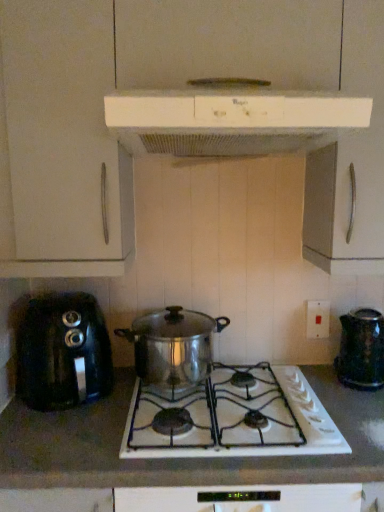
Question: Is shiny metallic kettle at right, the 1th kitchen appliance in the bottom-to-top sequence, to the right of white plastic electric outlet at right from the viewer's perspective?

Choices:
 (A) no
 (B) yes

Answer: (B)

Question: From a real-world perspective, is shiny metallic kettle at right, the 1th kitchen appliance in the bottom-to-top sequence, physically above white plastic electric outlet at right?

Choices:
 (A) yes
 (B) no

Answer: (B)

Question: Considering the relative sizes of shiny metallic kettle at right, acting as the 1th kitchen appliance starting from the right, and white plastic electric outlet at right in the image provided, is shiny metallic kettle at right, acting as the 1th kitchen appliance starting from the right, wider than white plastic electric outlet at right?

Choices:
 (A) yes
 (B) no

Answer: (A)

Question: Considering the relative positions of shiny metallic kettle at right, placed as the 4th kitchen appliance when sorted from top to bottom, and white plastic electric outlet at right in the image provided, is shiny metallic kettle at right, placed as the 4th kitchen appliance when sorted from top to bottom, behind white plastic electric outlet at right?

Choices:
 (A) yes
 (B) no

Answer: (B)

Question: Is shiny metallic kettle at right, marked as the fourth kitchen appliance in a left-to-right arrangement, at the left side of white plastic electric outlet at right?

Choices:
 (A) yes
 (B) no

Answer: (B)

Question: From the image's perspective, relative to white plastic range hood at upper center, which appears as the third kitchen appliance when viewed from the left, is black plastic toaster at left, which appears as the 3th kitchen appliance when viewed from the top, above or below?

Choices:
 (A) below
 (B) above

Answer: (A)

Question: Is black plastic toaster at left, which appears as the 3th kitchen appliance when viewed from the top, inside or outside of white plastic range hood at upper center, marked as the second kitchen appliance in a right-to-left arrangement?

Choices:
 (A) inside
 (B) outside

Answer: (B)

Question: Is black plastic toaster at left, positioned as the first kitchen appliance in left-to-right order, bigger or smaller than white plastic range hood at upper center, the 4th kitchen appliance ordered from the bottom?

Choices:
 (A) big
 (B) small

Answer: (B)

Question: Considering the relative positions of black plastic toaster at left, positioned as the first kitchen appliance in left-to-right order, and white plastic range hood at upper center, the 4th kitchen appliance ordered from the bottom, in the image provided, is black plastic toaster at left, positioned as the first kitchen appliance in left-to-right order, to the left or to the right of white plastic range hood at upper center, the 4th kitchen appliance ordered from the bottom,?

Choices:
 (A) right
 (B) left

Answer: (B)

Question: From a real-world perspective, relative to black plastic toaster at left, the second kitchen appliance positioned from the bottom, is white plastic range hood at upper center, arranged as the first kitchen appliance when viewed from the top, vertically above or below?

Choices:
 (A) above
 (B) below

Answer: (A)

Question: Does point (284, 103) appear closer or farther from the camera than point (97, 398)?

Choices:
 (A) farther
 (B) closer

Answer: (B)

Question: Is white plastic range hood at upper center, marked as the second kitchen appliance in a right-to-left arrangement, to the left or to the right of black plastic toaster at left, positioned as the first kitchen appliance in left-to-right order, in the image?

Choices:
 (A) left
 (B) right

Answer: (B)

Question: Looking at the image, does white plastic range hood at upper center, arranged as the first kitchen appliance when viewed from the top, seem bigger or smaller compared to black plastic toaster at left, positioned as the 4th kitchen appliance in right-to-left order?

Choices:
 (A) small
 (B) big

Answer: (B)

Question: Is black plastic toaster at left, positioned as the 4th kitchen appliance in right-to-left order, in front of or behind white ceramic stove at center in the image?

Choices:
 (A) behind
 (B) front

Answer: (A)

Question: From the image's perspective, is black plastic toaster at left, the second kitchen appliance positioned from the bottom, positioned above or below white ceramic stove at center?

Choices:
 (A) below
 (B) above

Answer: (B)